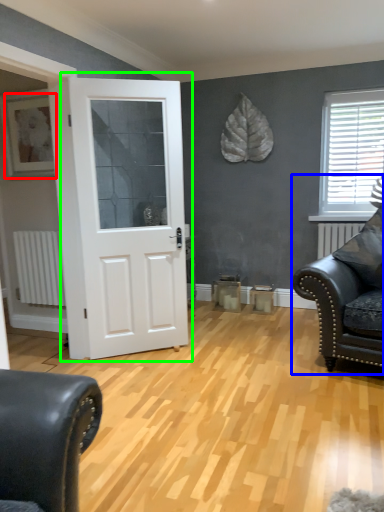
Question: Which is farther away from picture frame (highlighted by a red box)? studio couch (highlighted by a blue box) or door (highlighted by a green box)?

Choices:
 (A) studio couch
 (B) door

Answer: (A)